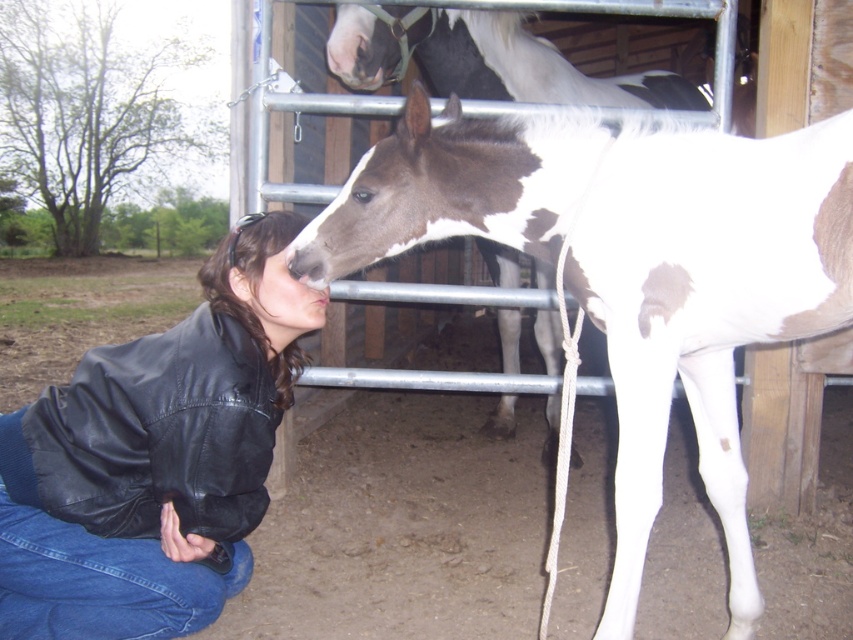
Question: Which point is closer to the camera?

Choices:
 (A) black leather jacket at lower left
 (B) white glossy horse at center
 (C) white and brown speckled horse at center

Answer: (B)

Question: Which of the following is the closest to the observer?

Choices:
 (A) white and brown speckled horse at center
 (B) black leather jacket at lower left

Answer: (B)

Question: Can you confirm if white glossy horse at center is positioned above black leather jacket at lower left?

Choices:
 (A) no
 (B) yes

Answer: (B)

Question: Can you confirm if white glossy horse at center is positioned above white and brown speckled horse at center?

Choices:
 (A) yes
 (B) no

Answer: (B)

Question: Where is black leather jacket at lower left located in relation to white and brown speckled horse at center in the image?

Choices:
 (A) left
 (B) right

Answer: (A)

Question: Estimate the real-world distances between objects in this image. Which object is farther from the black leather jacket at lower left?

Choices:
 (A) white and brown speckled horse at center
 (B) white glossy horse at center

Answer: (A)